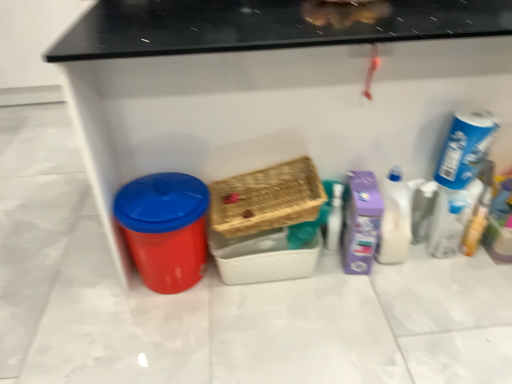
Find the location of `free space above purple cardboard box at right, acting as the third cleaning product starting from the right (from a real-world perspective)`. free space above purple cardboard box at right, acting as the third cleaning product starting from the right (from a real-world perspective) is located at coordinates (364, 188).